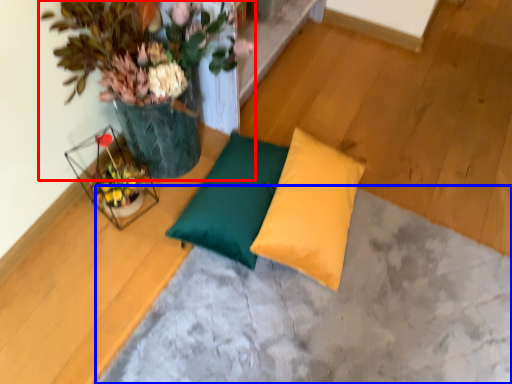
Question: Which object is further to the camera taking this photo, houseplant (highlighted by a red box) or concrete (highlighted by a blue box)?

Choices:
 (A) houseplant
 (B) concrete

Answer: (B)